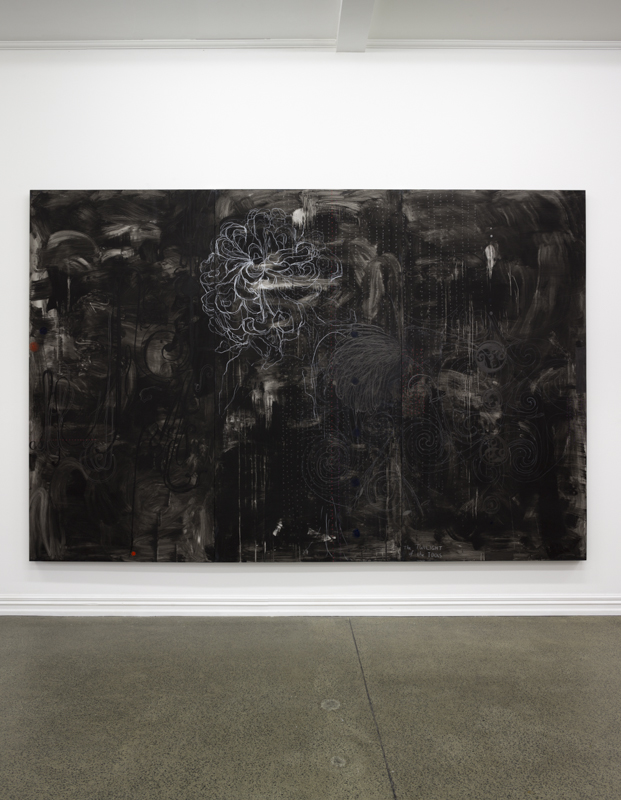
Where is `dirt spot on floor`? This screenshot has height=800, width=621. dirt spot on floor is located at coordinates (487, 690).